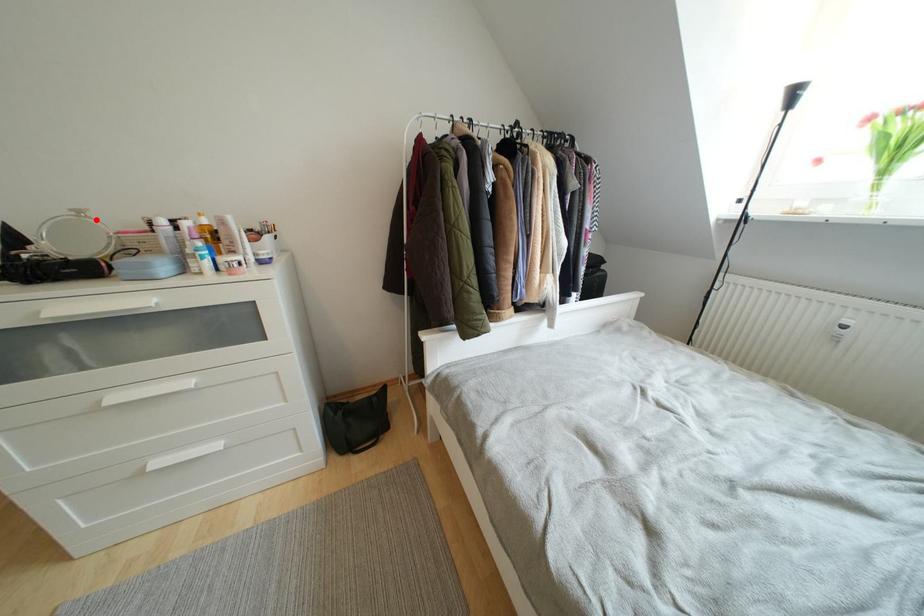
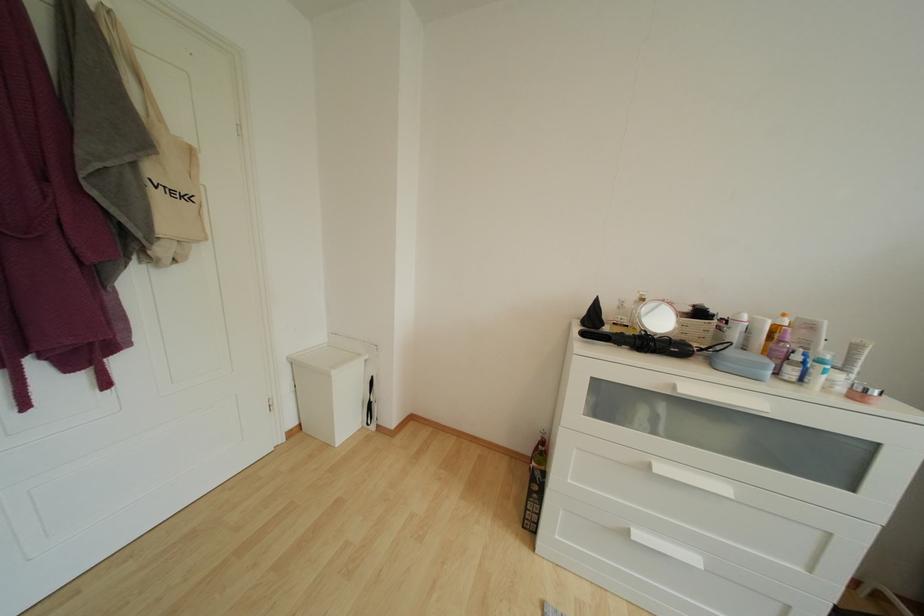
Where in the second image is the point corresponding to the highlighted location from the first image?

(651, 301)